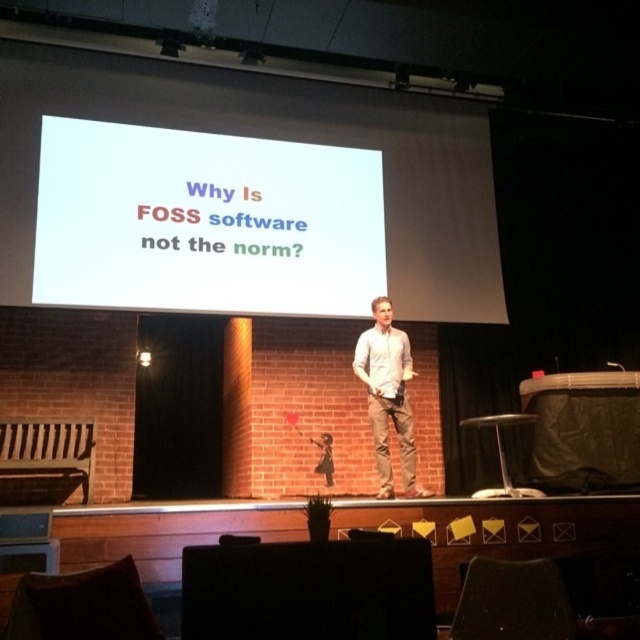
Question: Which point appears closest to the camera in this image?

Choices:
 (A) (356, 355)
 (B) (195, 262)

Answer: (A)

Question: Which of the following is the closest to the observer?

Choices:
 (A) metallic silver stool at lower right
 (B) white matte projection screen at upper center
 (C) white shirt at center

Answer: (A)

Question: Which object is positioned farthest from the white matte projection screen at center?

Choices:
 (A) white shirt at center
 (B) white matte projection screen at upper center

Answer: (A)

Question: Can you confirm if white shirt at center is smaller than metallic silver stool at lower right?

Choices:
 (A) no
 (B) yes

Answer: (B)

Question: Is white matte projection screen at upper center smaller than white shirt at center?

Choices:
 (A) no
 (B) yes

Answer: (A)

Question: Is white matte projection screen at upper center above metallic silver stool at lower right?

Choices:
 (A) yes
 (B) no

Answer: (A)